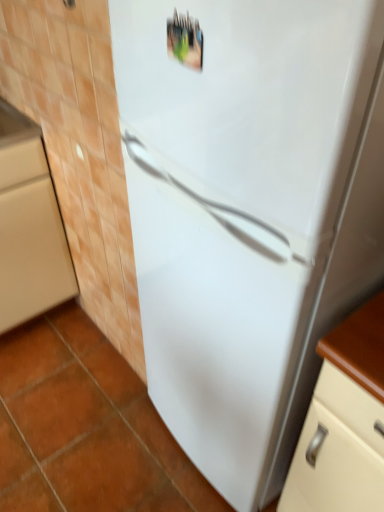
Identify the location of white glossy refrigerator at center. (248, 211).

The image size is (384, 512). What do you see at coordinates (248, 211) in the screenshot?
I see `white glossy refrigerator at center` at bounding box center [248, 211].

The width and height of the screenshot is (384, 512). What do you see at coordinates (29, 225) in the screenshot? I see `matte wood cabinet at lower left` at bounding box center [29, 225].

Locate an element on the screen. matte wood cabinet at lower left is located at coordinates (29, 225).

The image size is (384, 512). I want to click on white glossy refrigerator at center, so click(x=248, y=211).

Considering the positions of objects matte wood cabinet at lower left and white glossy refrigerator at center in the image provided, who is more to the right, matte wood cabinet at lower left or white glossy refrigerator at center?

white glossy refrigerator at center is more to the right.

From the picture: Which object is more forward, matte wood cabinet at lower left or white glossy refrigerator at center?

white glossy refrigerator at center.

Considering the positions of point (52, 305) and point (158, 318), is point (52, 305) closer or farther from the camera than point (158, 318)?

Point (52, 305).

From the image's perspective, which one is positioned higher, matte wood cabinet at lower left or white glossy refrigerator at center?

matte wood cabinet at lower left appears higher in the image.

From a real-world perspective, which is physically above, matte wood cabinet at lower left or white glossy refrigerator at center?

white glossy refrigerator at center.

Considering the sizes of matte wood cabinet at lower left and white glossy refrigerator at center in the image, is matte wood cabinet at lower left wider or thinner than white glossy refrigerator at center?

Clearly, matte wood cabinet at lower left has less width compared to white glossy refrigerator at center.

Can you confirm if matte wood cabinet at lower left is taller than white glossy refrigerator at center?

No.

In terms of size, does matte wood cabinet at lower left appear bigger or smaller than white glossy refrigerator at center?

matte wood cabinet at lower left is smaller than white glossy refrigerator at center.

Would you say matte wood cabinet at lower left is outside white glossy refrigerator at center?

Absolutely, matte wood cabinet at lower left is external to white glossy refrigerator at center.

Is the surface of matte wood cabinet at lower left in direct contact with white glossy refrigerator at center?

matte wood cabinet at lower left is not next to white glossy refrigerator at center, and they're not touching.

Is matte wood cabinet at lower left oriented towards white glossy refrigerator at center?

No, matte wood cabinet at lower left does not turn towards white glossy refrigerator at center.

Where is `cabinetry directly beneath the white glossy refrigerator at center (from a real-world perspective)`? The height and width of the screenshot is (512, 384). cabinetry directly beneath the white glossy refrigerator at center (from a real-world perspective) is located at coordinates (29, 225).

Can you confirm if white glossy refrigerator at center is positioned to the left of matte wood cabinet at lower left?

No, white glossy refrigerator at center is not to the left of matte wood cabinet at lower left.

Does white glossy refrigerator at center lie in front of matte wood cabinet at lower left?

Yes, it is.

Considering the positions of point (274, 249) and point (2, 189), is point (274, 249) closer or farther from the camera than point (2, 189)?

Point (274, 249) is positioned closer to the camera compared to point (2, 189).

From the image's perspective, is white glossy refrigerator at center beneath matte wood cabinet at lower left?

Yes.

From a real-world perspective, which is physically below, white glossy refrigerator at center or matte wood cabinet at lower left?

In real-world perspective, matte wood cabinet at lower left is lower.

Looking at their sizes, would you say white glossy refrigerator at center is wider or thinner than matte wood cabinet at lower left?

white glossy refrigerator at center is wider than matte wood cabinet at lower left.

Does white glossy refrigerator at center have a greater height compared to matte wood cabinet at lower left?

Yes, white glossy refrigerator at center is taller than matte wood cabinet at lower left.

Who is bigger, white glossy refrigerator at center or matte wood cabinet at lower left?

With larger size is white glossy refrigerator at center.

Is white glossy refrigerator at center not within matte wood cabinet at lower left?

Yes, white glossy refrigerator at center is located beyond the bounds of matte wood cabinet at lower left.

Is white glossy refrigerator at center not close to matte wood cabinet at lower left?

No, there isn't a large distance between white glossy refrigerator at center and matte wood cabinet at lower left.

In the scene shown: Is matte wood cabinet at lower left at the back of white glossy refrigerator at center?

white glossy refrigerator at center is not turned away from matte wood cabinet at lower left.

What's the angular difference between white glossy refrigerator at center and matte wood cabinet at lower left's facing directions?

white glossy refrigerator at center and matte wood cabinet at lower left are facing 92.5 degrees away from each other.

Locate an element on the screen. This screenshot has height=512, width=384. cabinetry lying above the white glossy refrigerator at center (from the image's perspective) is located at coordinates (29, 225).

You are a GUI agent. You are given a task and a screenshot of the screen. Output one action in this format:
    pyautogui.click(x=<x>, y=<y>)
    Task: Click on the refrigerator to the right of matte wood cabinet at lower left
    The height and width of the screenshot is (512, 384).
    Given the screenshot: What is the action you would take?
    pyautogui.click(x=248, y=211)

The width and height of the screenshot is (384, 512). I want to click on cabinetry on the left side of white glossy refrigerator at center, so click(29, 225).